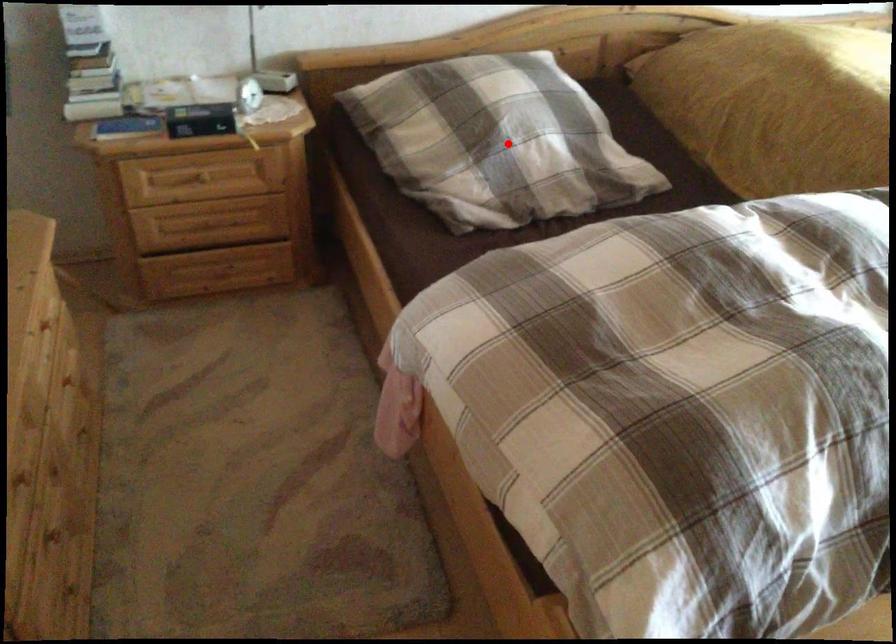
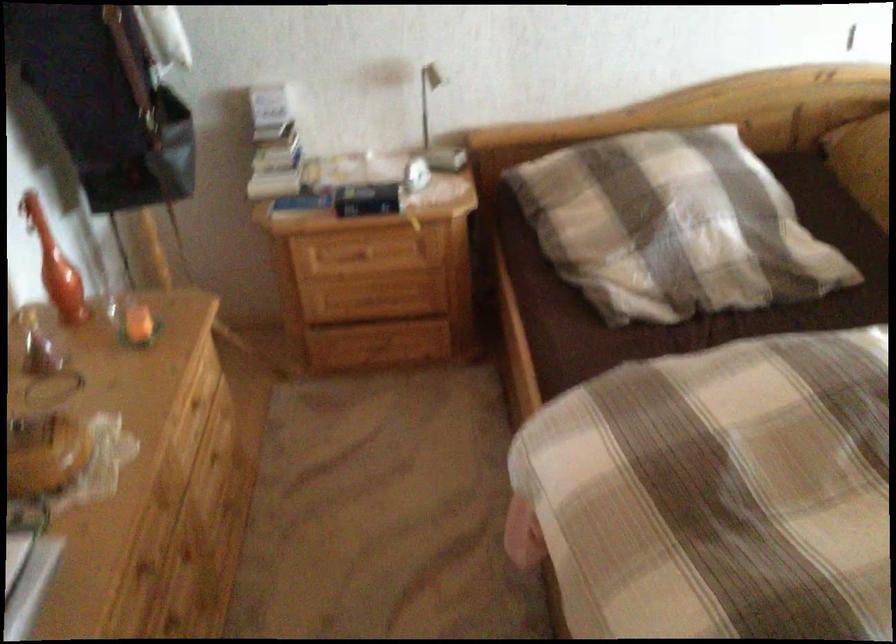
In the second image, find the point that corresponds to the highlighted location in the first image.

(673, 225)